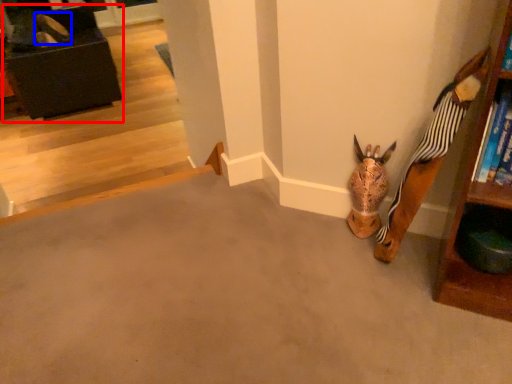
Question: Which object appears farthest to the camera in this image, furniture (highlighted by a red box) or shoe (highlighted by a blue box)?

Choices:
 (A) furniture
 (B) shoe

Answer: (B)